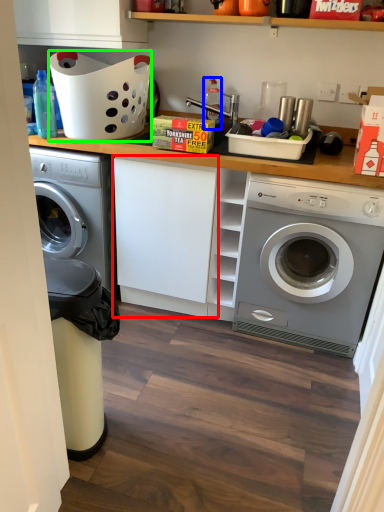
Question: Estimate the real-world distances between objects in this image. Which object is farther from cabinetry (highlighted by a red box), bottle (highlighted by a blue box) or basket (highlighted by a green box)?

Choices:
 (A) bottle
 (B) basket

Answer: (A)